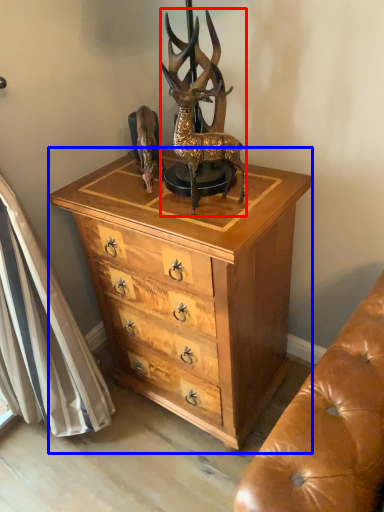
Question: Which point is further to the camera, deer (highlighted by a red box) or chest of drawers (highlighted by a blue box)?

Choices:
 (A) deer
 (B) chest of drawers

Answer: (B)